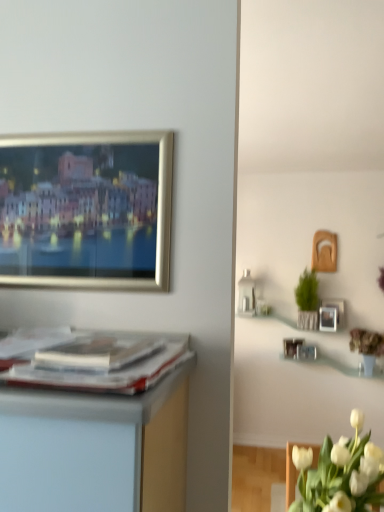
Question: Is point (349, 480) positioned closer to the camera than point (314, 287)?

Choices:
 (A) farther
 (B) closer

Answer: (B)

Question: Considering the positions of white matte tulip at lower right and green woven basket at upper right in the image, is white matte tulip at lower right bigger or smaller than green woven basket at upper right?

Choices:
 (A) big
 (B) small

Answer: (A)

Question: Which is nearer to the matte silver picture frame at upper right?

Choices:
 (A) green woven basket at upper right
 (B) white matte tulip at lower right
 (C) matte paper magazine at center

Answer: (A)

Question: Which of these objects is positioned farthest from the green woven basket at upper right?

Choices:
 (A) matte silver picture frame at upper right
 (B) matte paper magazine at center
 (C) white matte tulip at lower right

Answer: (B)